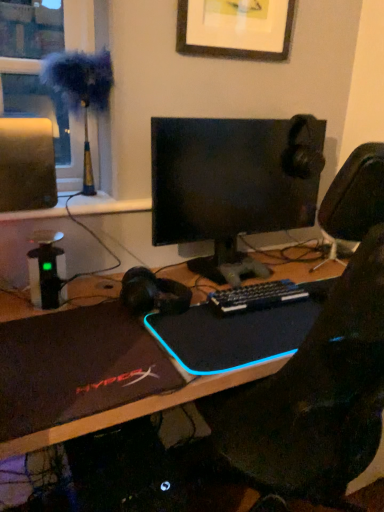
Question: Is fuzzy fabric at left to the right of black matte laptop at center, arranged as the first laptop when viewed from the right, from the viewer's perspective?

Choices:
 (A) yes
 (B) no

Answer: (B)

Question: Does fuzzy fabric at left have a greater height compared to black matte laptop at center, placed as the second laptop when sorted from left to right?

Choices:
 (A) no
 (B) yes

Answer: (B)

Question: Considering the relative positions of fuzzy fabric at left and black matte laptop at center, arranged as the first laptop when viewed from the right, in the image provided, is fuzzy fabric at left in front of black matte laptop at center, arranged as the first laptop when viewed from the right,?

Choices:
 (A) yes
 (B) no

Answer: (B)

Question: Can you confirm if fuzzy fabric at left is wider than black matte laptop at center, placed as the second laptop when sorted from left to right?

Choices:
 (A) yes
 (B) no

Answer: (B)

Question: Can you confirm if fuzzy fabric at left is smaller than black matte laptop at center, placed as the second laptop when sorted from left to right?

Choices:
 (A) no
 (B) yes

Answer: (A)

Question: From a real-world perspective, is fuzzy fabric at left located beneath black matte laptop at center, placed as the second laptop when sorted from left to right?

Choices:
 (A) yes
 (B) no

Answer: (B)

Question: Is black plastic keyboard at center not close to black matte laptop at center, placed as the second laptop when sorted from left to right?

Choices:
 (A) yes
 (B) no

Answer: (B)

Question: From a real-world perspective, does black plastic keyboard at center sit lower than black matte laptop at center, arranged as the first laptop when viewed from the right?

Choices:
 (A) no
 (B) yes

Answer: (B)

Question: Is black plastic keyboard at center at the right side of black matte laptop at center, placed as the second laptop when sorted from left to right?

Choices:
 (A) no
 (B) yes

Answer: (A)

Question: Is black plastic keyboard at center oriented away from black matte laptop at center, placed as the second laptop when sorted from left to right?

Choices:
 (A) no
 (B) yes

Answer: (B)

Question: From the image's perspective, is black plastic keyboard at center beneath black matte laptop at center, placed as the second laptop when sorted from left to right?

Choices:
 (A) no
 (B) yes

Answer: (A)

Question: Can you confirm if black plastic keyboard at center is shorter than black matte laptop at center, placed as the second laptop when sorted from left to right?

Choices:
 (A) yes
 (B) no

Answer: (B)

Question: Considering the relative sizes of fuzzy fabric at left and wooden picture frame at upper center in the image provided, is fuzzy fabric at left taller than wooden picture frame at upper center?

Choices:
 (A) no
 (B) yes

Answer: (B)